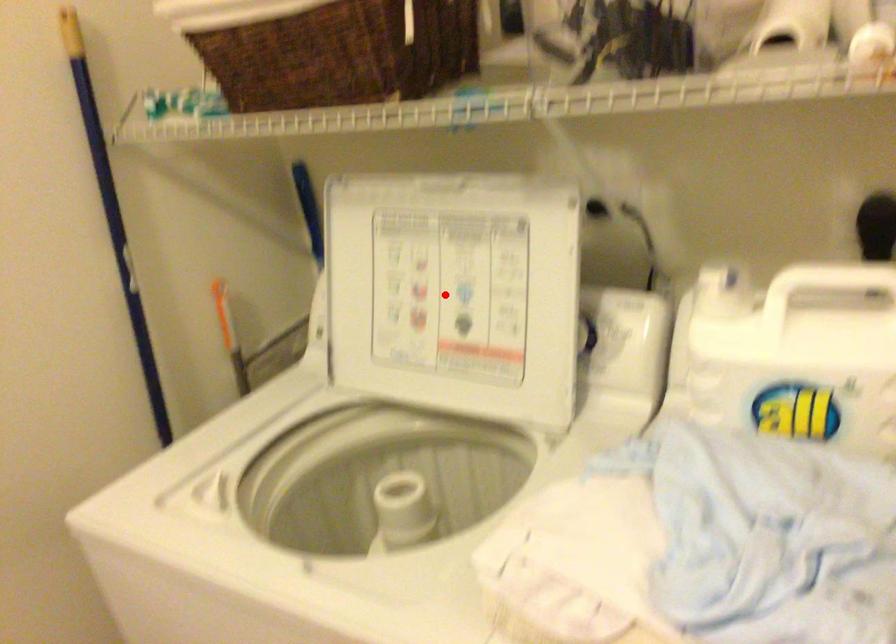
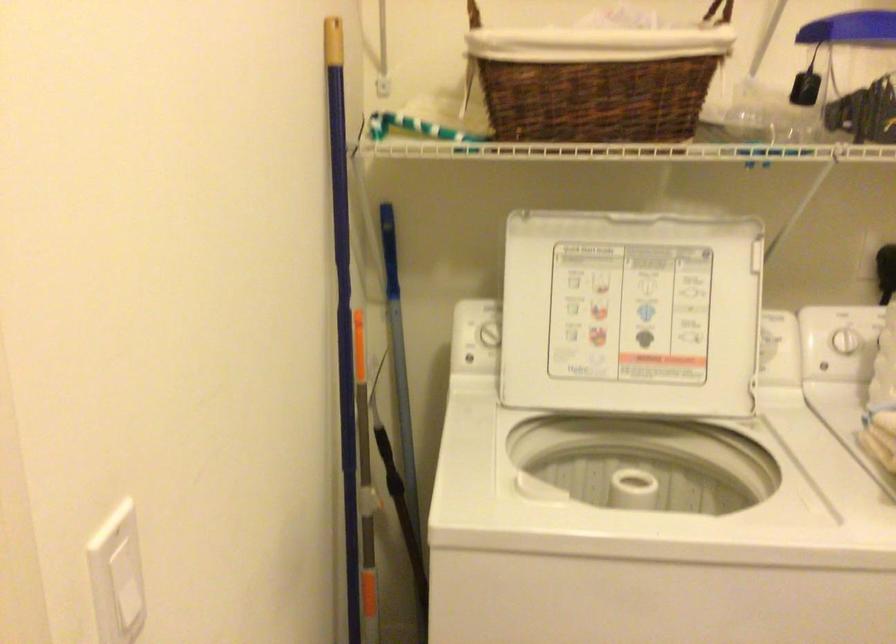
Question: I am providing you with two images of the same scene from different viewpoints. In image1, a red point is highlighted. Considering the same 3D point in image2, which of the following is correct?

Choices:
 (A) It is closer
 (B) It is farther

Answer: (B)